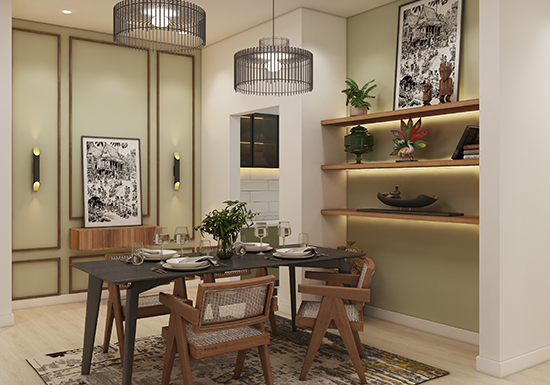
This screenshot has width=550, height=385. In order to click on table in this screenshot , I will do `click(118, 275)`.